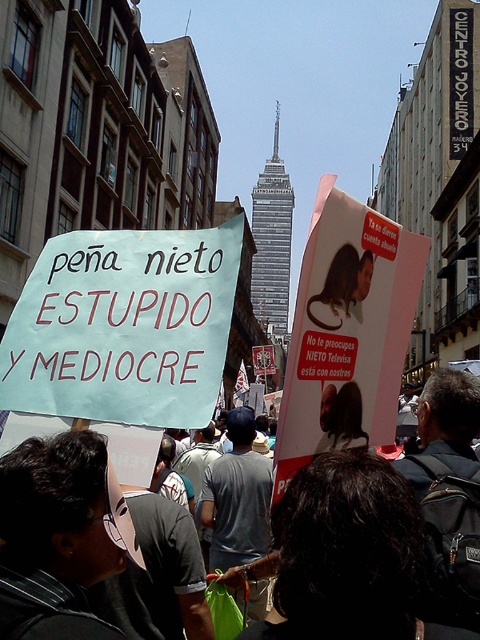
Question: Can you confirm if white paper sign at center is positioned above dark gray fabric at center?

Choices:
 (A) no
 (B) yes

Answer: (B)

Question: Which of the following is the closest to the observer?

Choices:
 (A) (477, 420)
 (B) (96, 394)

Answer: (B)

Question: Is white paper sign at center positioned before dark gray fabric at center?

Choices:
 (A) yes
 (B) no

Answer: (A)

Question: Is white paper sign at center below dark gray fabric at center?

Choices:
 (A) no
 (B) yes

Answer: (A)